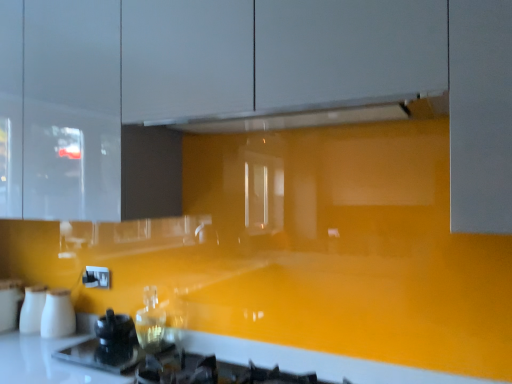
Find the location of a particular element. The image size is (512, 384). vacant space situated above glossy yellow countertop at lower center (from a real-world perspective) is located at coordinates (259, 337).